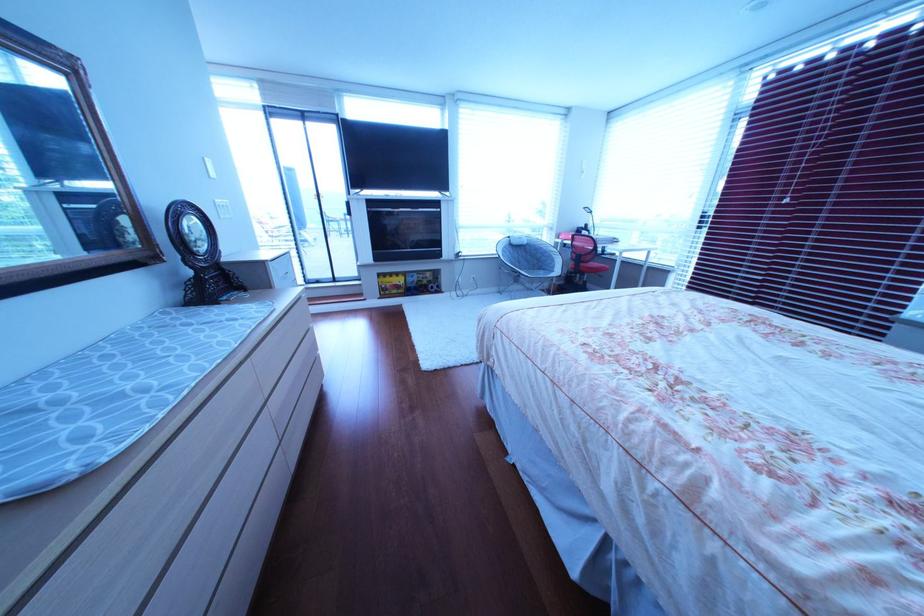
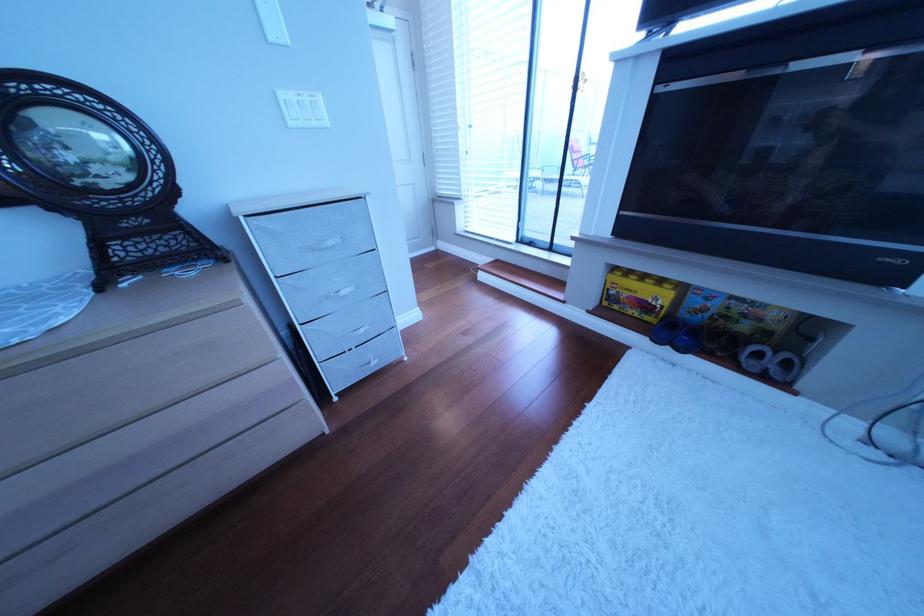
The point at (x=237, y=217) is marked in the first image. Where is the corresponding point in the second image?

(307, 126)